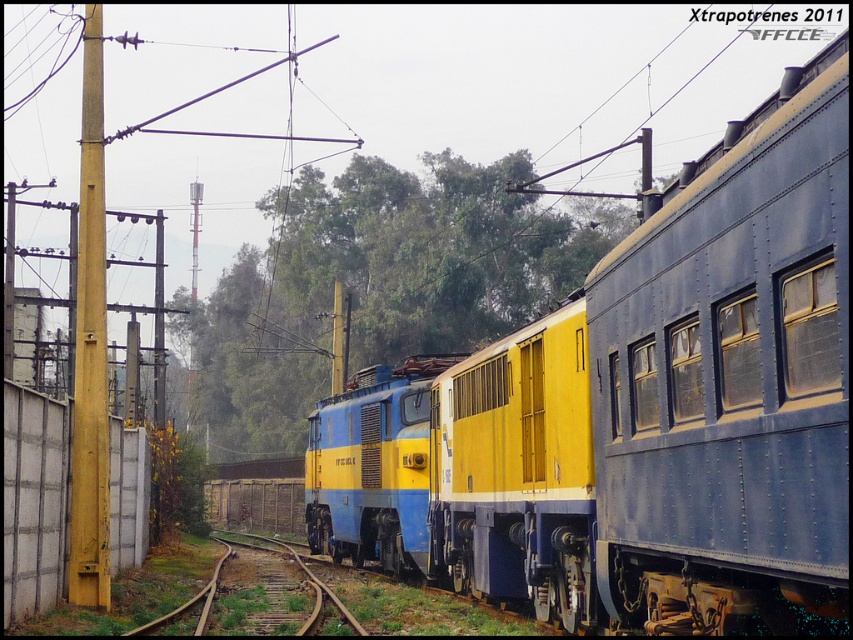
Question: Considering the real-world distances, which object is farthest from the blue/yellow painted locomotive at center?

Choices:
 (A) brown wooden train track at center
 (B) green leafy tree at center
 (C) yellow painted metal pole at left

Answer: (B)

Question: Which point is closer to the camera?

Choices:
 (A) (96, 314)
 (B) (335, 600)
 (C) (566, 218)
 (D) (358, 456)

Answer: (A)

Question: Is blue/yellow painted locomotive at center to the left of green leafy tree at center from the viewer's perspective?

Choices:
 (A) yes
 (B) no

Answer: (B)

Question: Can you confirm if blue/yellow painted locomotive at center is thinner than brown wooden train track at center?

Choices:
 (A) no
 (B) yes

Answer: (A)

Question: Estimate the real-world distances between objects in this image. Which object is closer to the blue/yellow painted locomotive at center?

Choices:
 (A) green leafy tree at center
 (B) brown wooden train track at center
 (C) yellow painted metal pole at left

Answer: (B)

Question: Does blue/yellow painted locomotive at center appear on the right side of brown wooden train track at center?

Choices:
 (A) no
 (B) yes

Answer: (B)